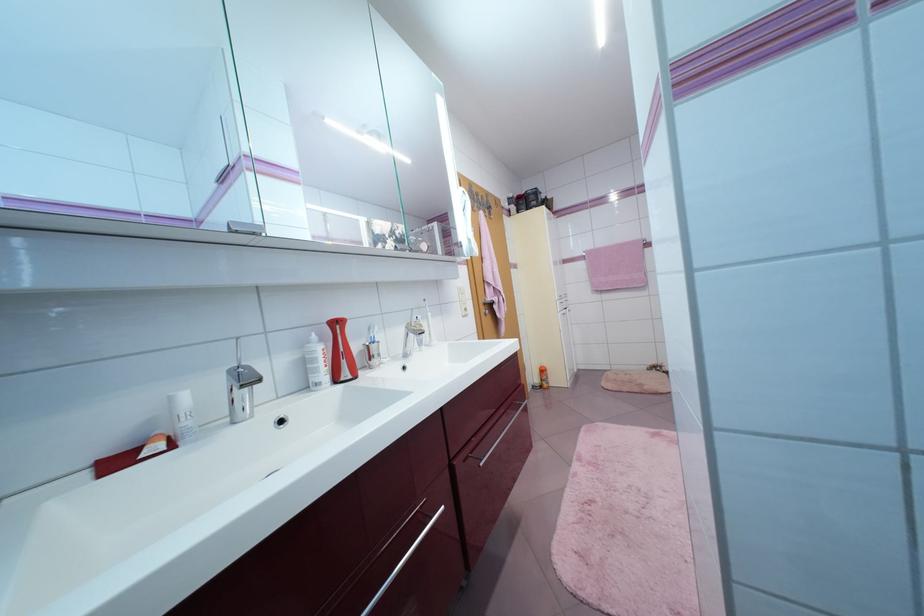
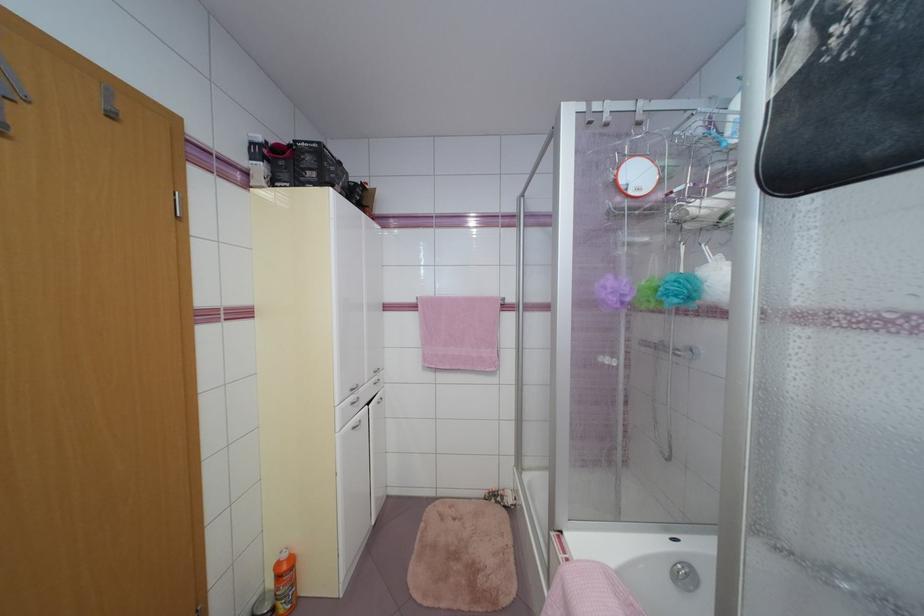
In the second image, find the point that corresponds to point 565,302 in the first image.

(357, 400)